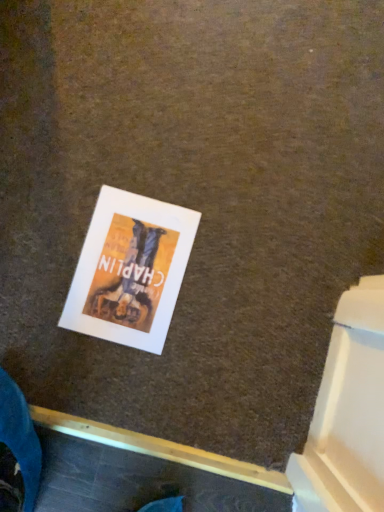
The image size is (384, 512). What do you see at coordinates (130, 270) in the screenshot?
I see `matte paper poster at center` at bounding box center [130, 270].

Measure the distance between matte paper poster at center and camera.

matte paper poster at center and camera are 33.62 inches apart from each other.

Locate an element on the screen. This screenshot has width=384, height=512. matte paper poster at center is located at coordinates (130, 270).

Locate an element on the screen. matte paper poster at center is located at coordinates (130, 270).